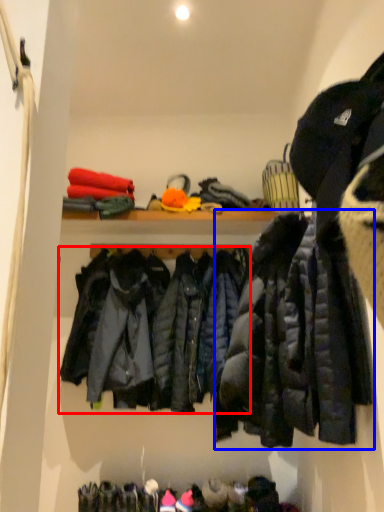
Question: Which point is further to the camera, jacket (highlighted by a red box) or jacket (highlighted by a blue box)?

Choices:
 (A) jacket
 (B) jacket

Answer: (A)